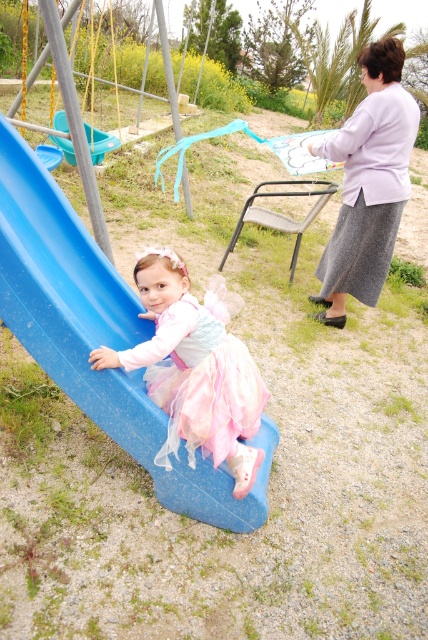
Question: Which is nearer to the pink tulle dress at left?

Choices:
 (A) pastel tulle dress at lower left
 (B) teal plastic swing at upper left

Answer: (A)

Question: Is light purple fabric skirt at upper right to the left of pastel tulle dress at lower left from the viewer's perspective?

Choices:
 (A) yes
 (B) no

Answer: (B)

Question: Which point is closer to the camera taking this photo?

Choices:
 (A) click(196, 369)
 (B) click(61, 122)
 (C) click(321, 276)
 (D) click(210, 317)

Answer: (A)

Question: Does blue plastic slide at left appear on the left side of teal plastic swing at upper left?

Choices:
 (A) yes
 (B) no

Answer: (B)

Question: Which point is closer to the camera?

Choices:
 (A) pastel tulle dress at lower left
 (B) blue plastic slide at left

Answer: (A)

Question: Does pink tulle dress at left have a greater width compared to teal plastic swing at upper left?

Choices:
 (A) no
 (B) yes

Answer: (A)